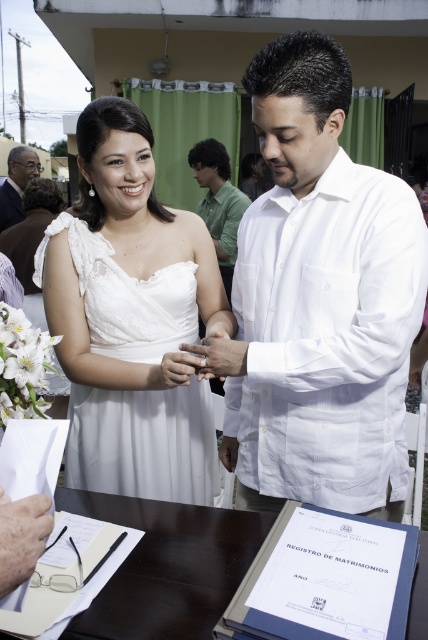
Question: From the image, what is the correct spatial relationship of white satin dress at center in relation to white matte ring at center?

Choices:
 (A) left
 (B) right

Answer: (A)

Question: Based on their relative distances, which object is farther from the white matte ring at center?

Choices:
 (A) white cotton shirt at center
 (B) white satin dress at center
 (C) matte black suit at left

Answer: (C)

Question: Does white cotton shirt at center lie in front of matte black suit at left?

Choices:
 (A) no
 (B) yes

Answer: (B)

Question: Does white satin dress at center appear on the left side of green matte shirt at center?

Choices:
 (A) yes
 (B) no

Answer: (A)

Question: Which point appears farthest from the camera in this image?

Choices:
 (A) (29, 157)
 (B) (241, 330)
 (C) (226, 368)
 (D) (107, 264)

Answer: (A)

Question: Which of the following is the closest to the observer?

Choices:
 (A) (222, 337)
 (B) (192, 160)
 (C) (18, 168)

Answer: (A)